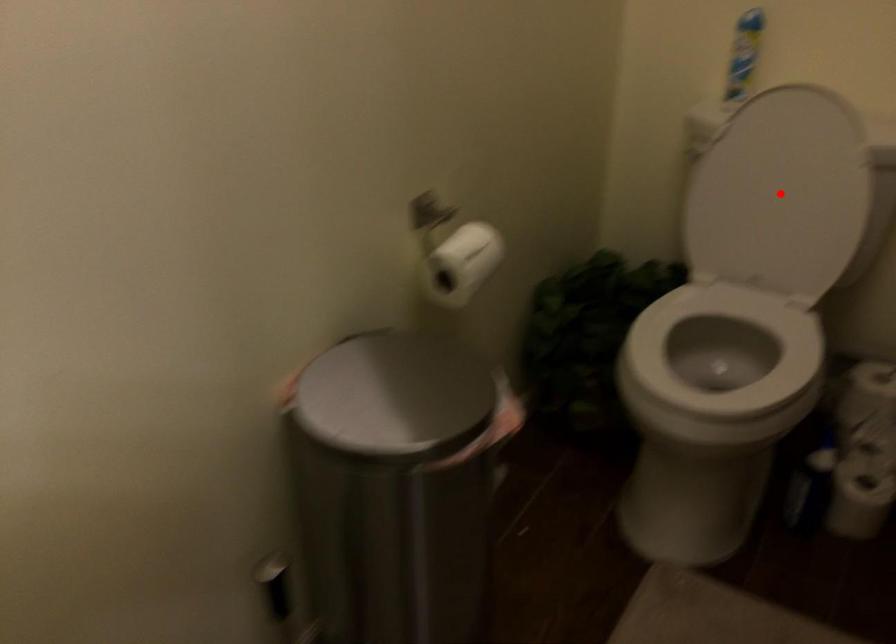
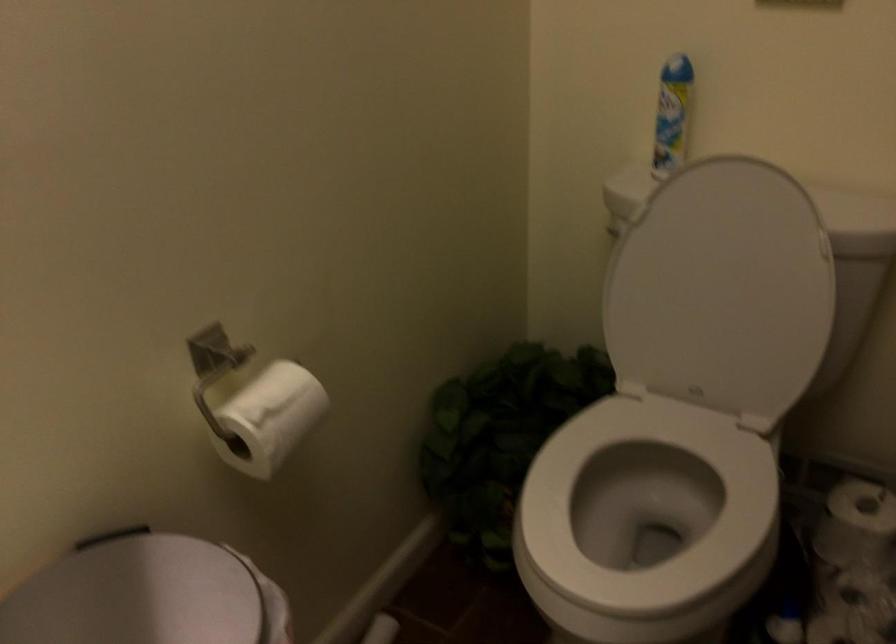
Question: I am providing you with two images of the same scene from different viewpoints. A red point is marked on the first image. Is the red point's position out of view in image 2?

Choices:
 (A) Yes
 (B) No

Answer: (B)